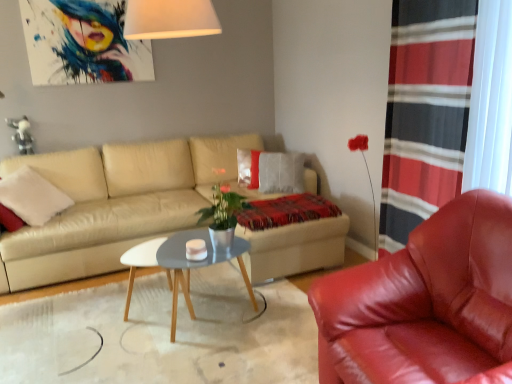
Image resolution: width=512 pixels, height=384 pixels. In order to click on vacant area that lies to the right of gray wooden coffee table at center in this screenshot , I will do `click(285, 321)`.